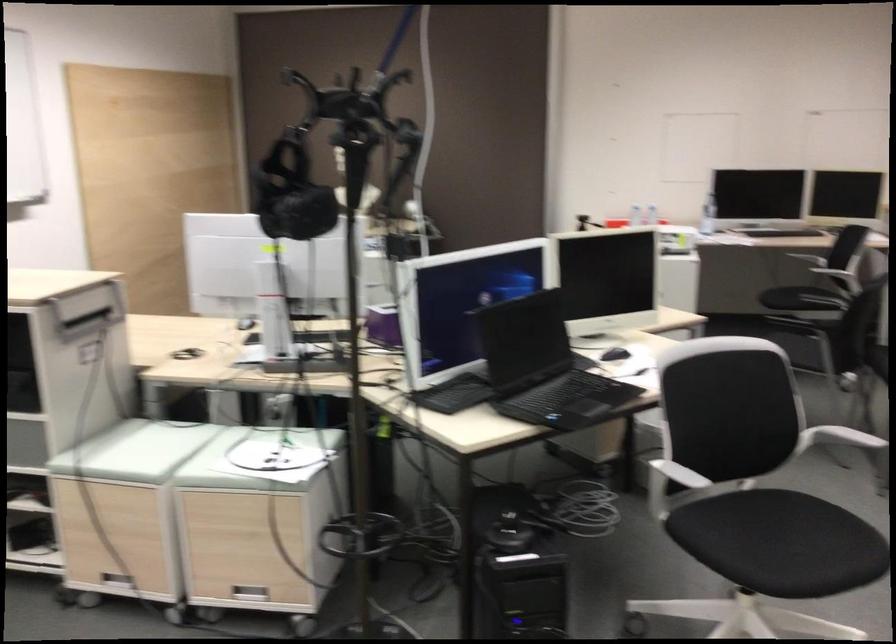
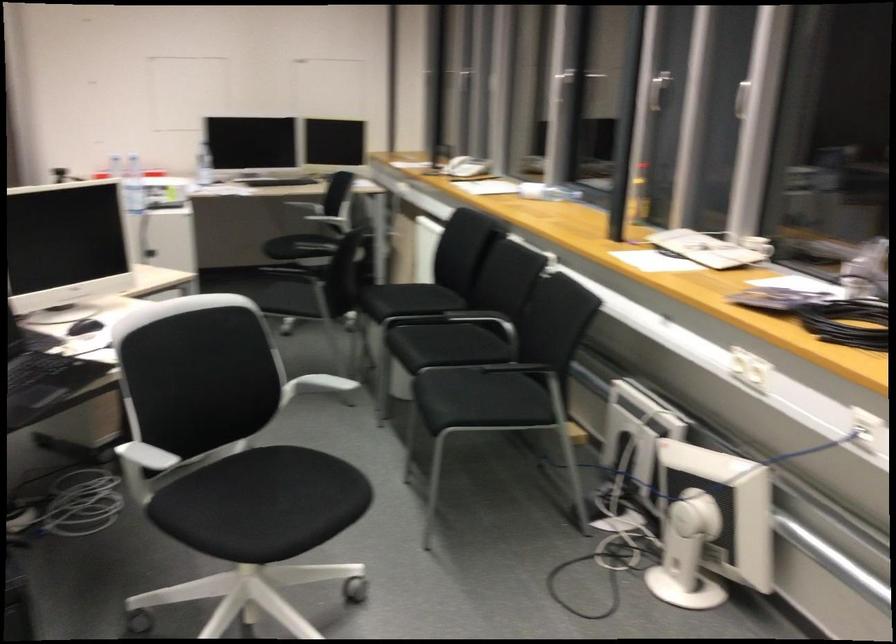
Where in the second image is the point corresponding to (802,299) from the first image?

(287, 257)